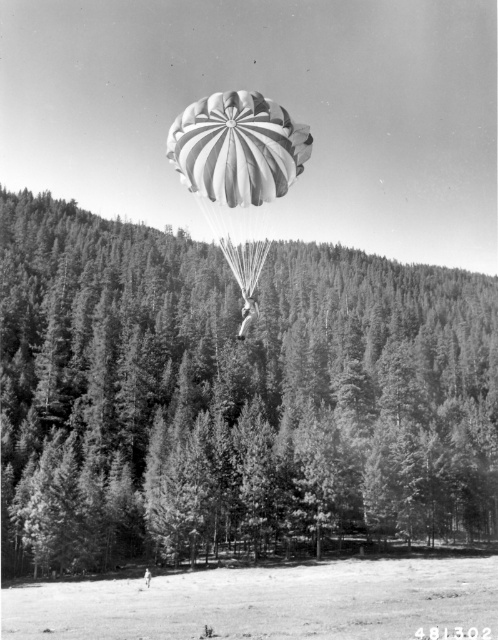
You are a pilot observing the parachutist from above. You notice the white striped parachute at center and the white cotton shirt at center. Which object is located to the right when viewed from your perspective?

The white cotton shirt at center is located to the right of the white striped parachute at center.

You are a pilot trying to land a small plane in the forest. You see the white striped parachute at center in the image. Where should you aim your plane to land safely?

You should aim your plane to the area below the white striped parachute at center, as the parachute is located at coordinates point (239, 173), which indicates the parachutist is descending there. The open land below the parachute provides a safer landing spot compared to the dense forest further away.